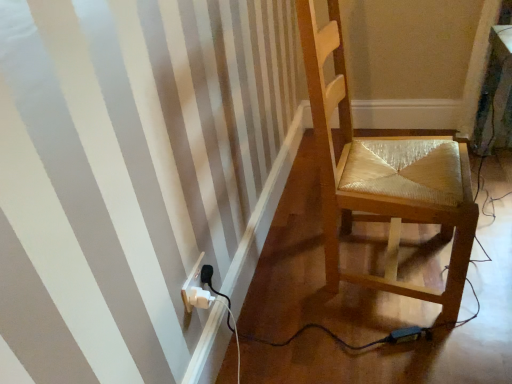
Locate an element on the screen. The image size is (512, 384). free space in front of wooden chair at right is located at coordinates (404, 344).